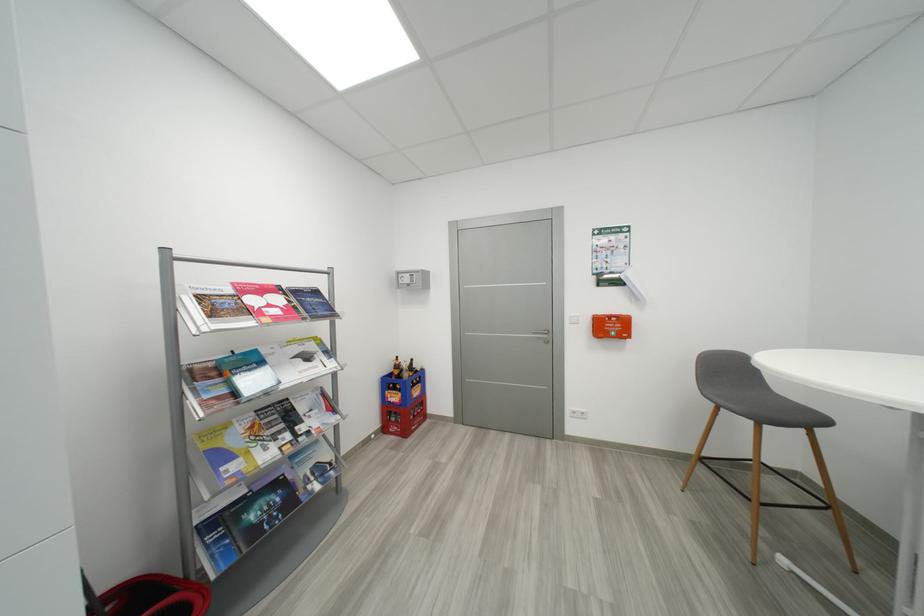
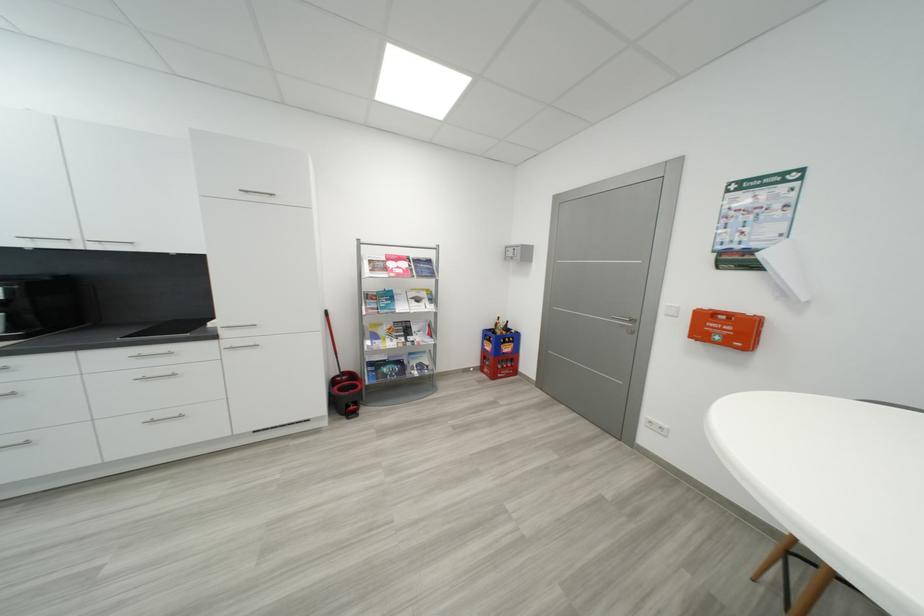
Locate, in the second image, the point that corresponds to (252,312) in the first image.

(393, 270)